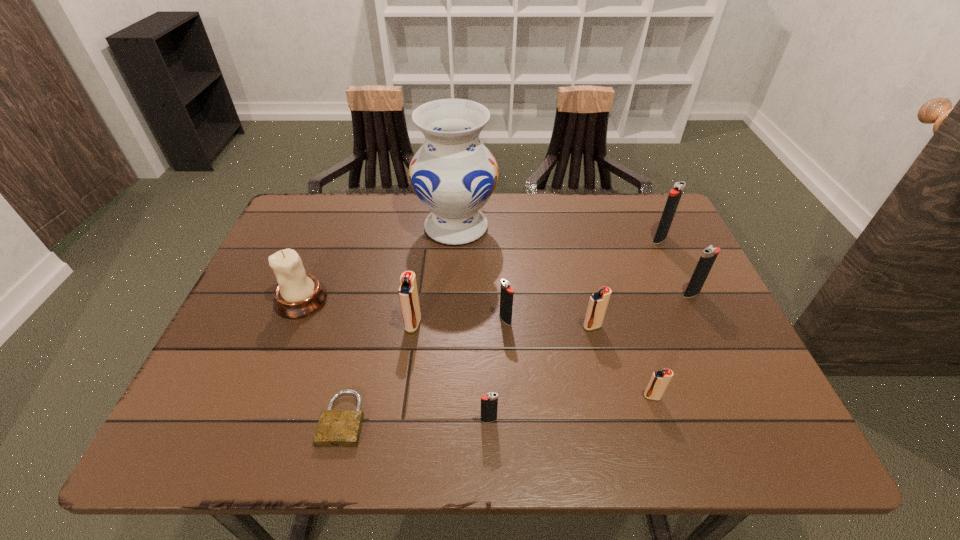
The height and width of the screenshot is (540, 960). In order to click on red vase in this screenshot , I will do `click(453, 174)`.

Find the location of a particular element. The width and height of the screenshot is (960, 540). the tallest object is located at coordinates (453, 174).

You are a GUI agent. You are given a task and a screenshot of the screen. Output one action in this format:
    pyautogui.click(x=<x>, y=<y>)
    Task: Click on the tallest igniter
    The width and height of the screenshot is (960, 540).
    Given the screenshot: What is the action you would take?
    pyautogui.click(x=675, y=194)

Find the location of a particular element. The height and width of the screenshot is (540, 960). the farthest black igniter is located at coordinates (675, 194).

The width and height of the screenshot is (960, 540). What are the coordinates of `candle holder` in the screenshot? It's located at (297, 295).

Where is `white candle holder`? white candle holder is located at coordinates (297, 295).

Where is `the leftmost igniter`? This screenshot has width=960, height=540. the leftmost igniter is located at coordinates (408, 294).

Where is `the leftmost red igniter`? the leftmost red igniter is located at coordinates (408, 294).

The image size is (960, 540). I want to click on the second biggest black igniter, so click(709, 254).

Locate an element on the screen. the second farthest black igniter is located at coordinates (709, 254).